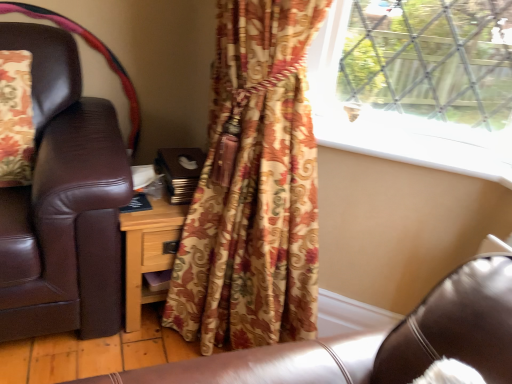
Question: From a real-world perspective, is white smooth window sill at upper center beneath wooden nightstand at center?

Choices:
 (A) no
 (B) yes

Answer: (A)

Question: Would you say white smooth window sill at upper center is outside wooden nightstand at center?

Choices:
 (A) yes
 (B) no

Answer: (A)

Question: From a real-world perspective, is white smooth window sill at upper center positioned over wooden nightstand at center based on gravity?

Choices:
 (A) no
 (B) yes

Answer: (B)

Question: Does white smooth window sill at upper center touch wooden nightstand at center?

Choices:
 (A) no
 (B) yes

Answer: (A)

Question: Is white smooth window sill at upper center at the left side of wooden nightstand at center?

Choices:
 (A) yes
 (B) no

Answer: (B)

Question: Considering the relative sizes of white smooth window sill at upper center and wooden nightstand at center in the image provided, is white smooth window sill at upper center taller than wooden nightstand at center?

Choices:
 (A) yes
 (B) no

Answer: (B)

Question: From a real-world perspective, is floral fabric curtain at center physically below white smooth window sill at upper center?

Choices:
 (A) no
 (B) yes

Answer: (B)

Question: Is floral fabric curtain at center with white smooth window sill at upper center?

Choices:
 (A) no
 (B) yes

Answer: (A)

Question: From the image's perspective, is floral fabric curtain at center on top of white smooth window sill at upper center?

Choices:
 (A) no
 (B) yes

Answer: (A)

Question: Is floral fabric curtain at center smaller than white smooth window sill at upper center?

Choices:
 (A) no
 (B) yes

Answer: (A)

Question: Is floral fabric curtain at center positioned far away from white smooth window sill at upper center?

Choices:
 (A) no
 (B) yes

Answer: (A)

Question: Is floral fabric curtain at center taller than white smooth window sill at upper center?

Choices:
 (A) yes
 (B) no

Answer: (A)

Question: From the image's perspective, is wooden nightstand at center beneath white smooth window sill at upper center?

Choices:
 (A) no
 (B) yes

Answer: (B)